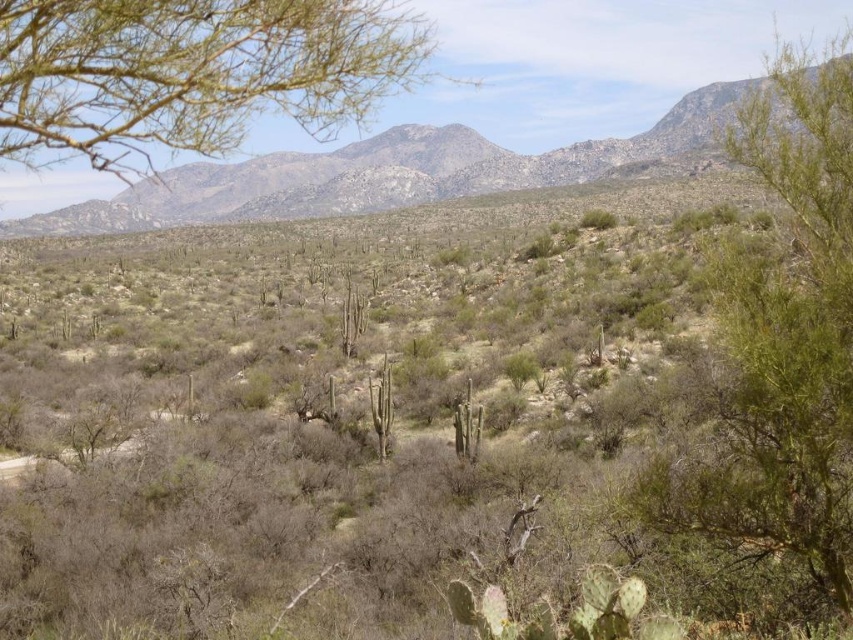
Question: Estimate the real-world distances between objects in this image. Which object is closer to the green leafy tree at upper left?

Choices:
 (A) green leafy bush at right
 (B) gray rocky mountain at upper center

Answer: (B)

Question: Which point is closer to the camera?

Choices:
 (A) green leafy tree at upper left
 (B) green leafy bush at right

Answer: (A)

Question: Can you confirm if green leafy bush at right is thinner than gray rocky mountain at upper center?

Choices:
 (A) no
 (B) yes

Answer: (B)

Question: Which object is closer to the camera taking this photo?

Choices:
 (A) green leafy bush at right
 (B) gray rocky mountain at upper center

Answer: (A)

Question: Does green leafy bush at right have a smaller size compared to gray rocky mountain at upper center?

Choices:
 (A) yes
 (B) no

Answer: (A)

Question: In this image, where is green leafy bush at right located relative to green leafy tree at upper left?

Choices:
 (A) left
 (B) right

Answer: (B)